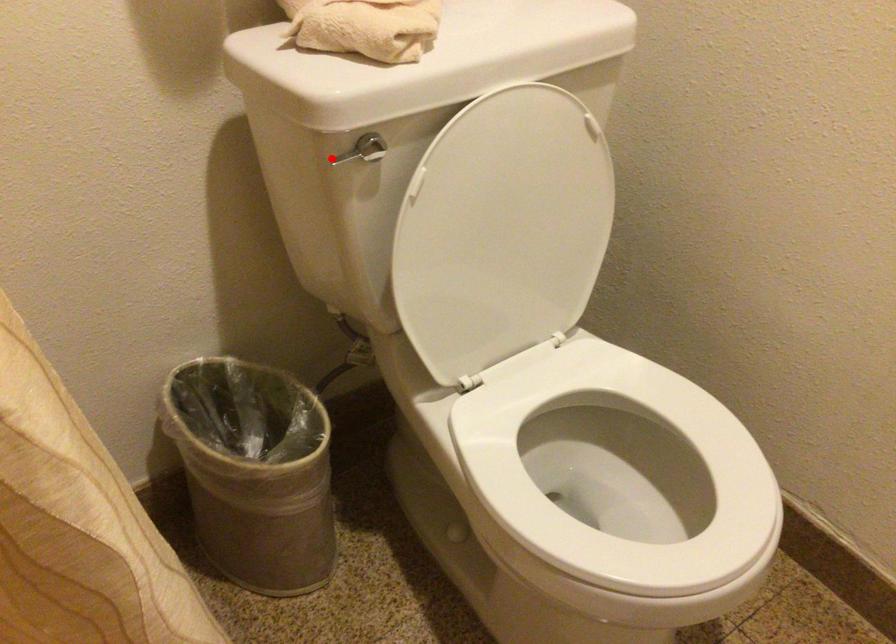
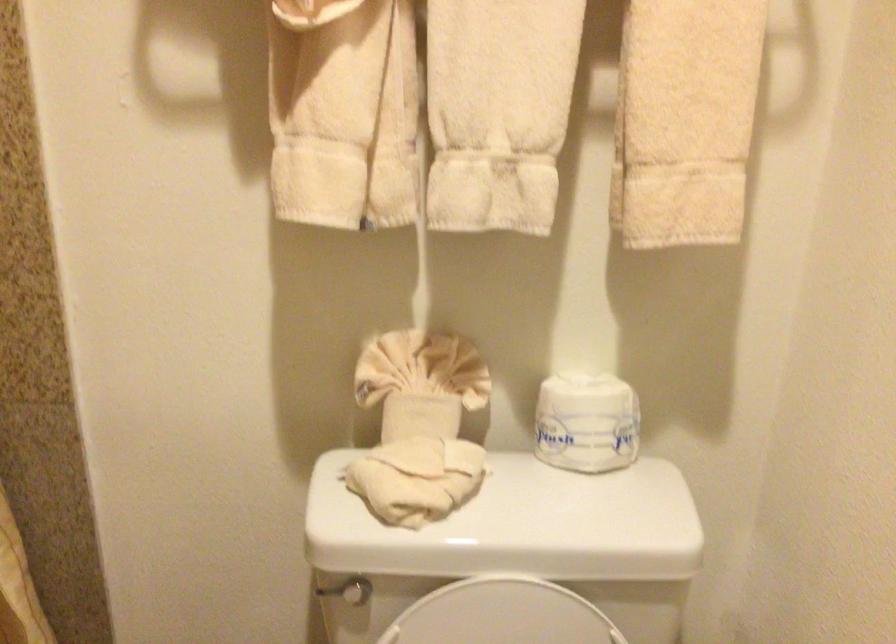
Find the pixel in the second image that matches the highlighted location in the first image.

(326, 590)